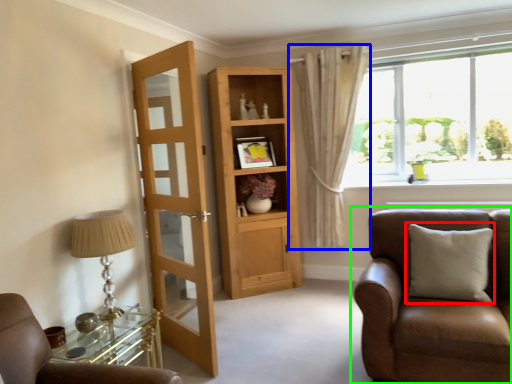
Question: Considering the real-world distances, which object is closest to pillow (highlighted by a red box)? curtain (highlighted by a blue box) or chair (highlighted by a green box).

Choices:
 (A) curtain
 (B) chair

Answer: (B)